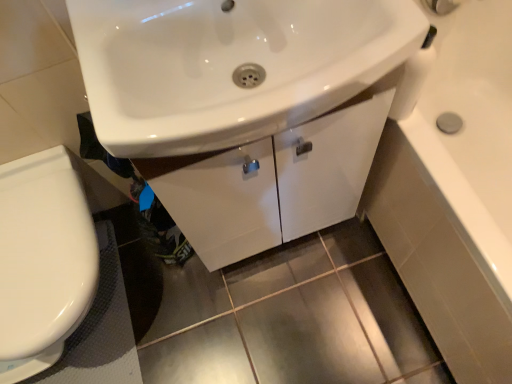
Question: Considering the relative sizes of white glossy toilet at lower left and white glossy sink at center in the image provided, is white glossy toilet at lower left wider than white glossy sink at center?

Choices:
 (A) yes
 (B) no

Answer: (A)

Question: Does white glossy toilet at lower left appear on the left side of white glossy sink at center?

Choices:
 (A) no
 (B) yes

Answer: (B)

Question: Is white glossy toilet at lower left positioned beyond the bounds of white glossy sink at center?

Choices:
 (A) yes
 (B) no

Answer: (A)

Question: Could you tell me if white glossy toilet at lower left is facing white glossy sink at center?

Choices:
 (A) yes
 (B) no

Answer: (B)

Question: Is white glossy toilet at lower left not close to white glossy sink at center?

Choices:
 (A) no
 (B) yes

Answer: (A)

Question: In the image, is white glossy cabinet at center on the left side or the right side of white glossy toilet at lower left?

Choices:
 (A) right
 (B) left

Answer: (A)

Question: Considering the positions of point (270, 147) and point (20, 187), is point (270, 147) closer or farther from the camera than point (20, 187)?

Choices:
 (A) farther
 (B) closer

Answer: (B)

Question: Considering the positions of white glossy cabinet at center and white glossy toilet at lower left in the image, is white glossy cabinet at center taller or shorter than white glossy toilet at lower left?

Choices:
 (A) short
 (B) tall

Answer: (B)

Question: From the image's perspective, is white glossy cabinet at center located above or below white glossy toilet at lower left?

Choices:
 (A) below
 (B) above

Answer: (B)

Question: In terms of width, does white glossy toilet at lower left look wider or thinner when compared to black rubber bath mat at lower left?

Choices:
 (A) wide
 (B) thin

Answer: (A)

Question: From their relative heights in the image, would you say white glossy toilet at lower left is taller or shorter than black rubber bath mat at lower left?

Choices:
 (A) short
 (B) tall

Answer: (B)

Question: From the image's perspective, relative to black rubber bath mat at lower left, is white glossy toilet at lower left above or below?

Choices:
 (A) below
 (B) above

Answer: (B)

Question: Is point (3, 311) closer or farther from the camera than point (75, 370)?

Choices:
 (A) farther
 (B) closer

Answer: (B)

Question: Would you say white glossy sink at center is inside or outside white glossy faucet at upper center?

Choices:
 (A) inside
 (B) outside

Answer: (B)

Question: In terms of width, does white glossy sink at center look wider or thinner when compared to white glossy faucet at upper center?

Choices:
 (A) thin
 (B) wide

Answer: (B)